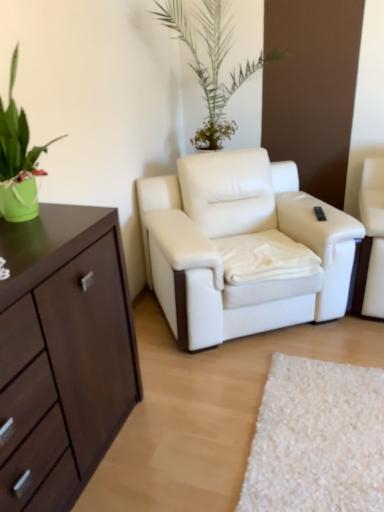
Question: Looking at their shapes, would you say white leather armchair at center is wider or thinner than green matte pot at left?

Choices:
 (A) thin
 (B) wide

Answer: (B)

Question: From their relative heights in the image, would you say white leather armchair at center is taller or shorter than green matte pot at left?

Choices:
 (A) short
 (B) tall

Answer: (B)

Question: Which is nearer to the green matte pot at left?

Choices:
 (A) black plastic remote control at upper right
 (B) white leather armchair at center

Answer: (B)

Question: Which object is the closest to the black plastic remote control at upper right?

Choices:
 (A) green matte pot at left
 (B) white leather armchair at center

Answer: (B)